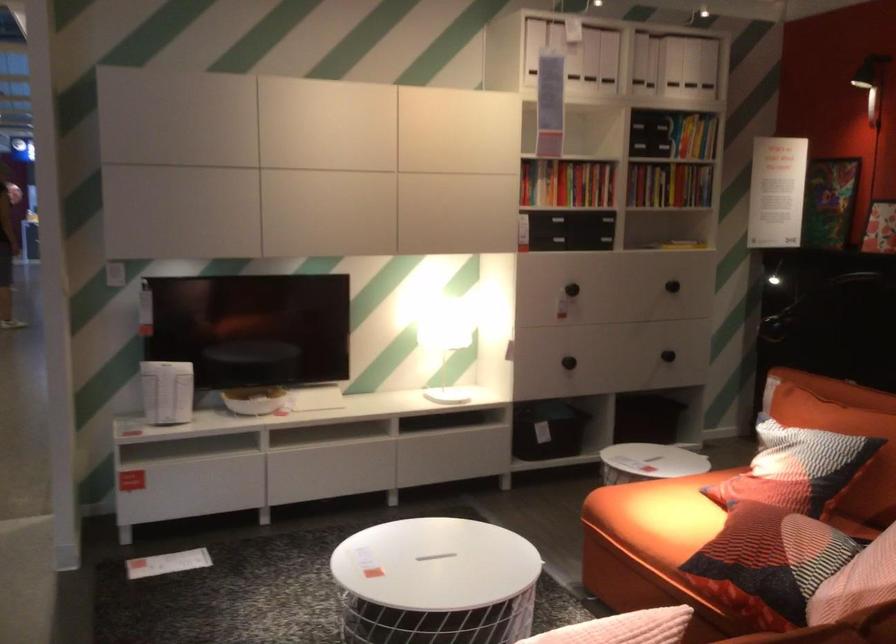
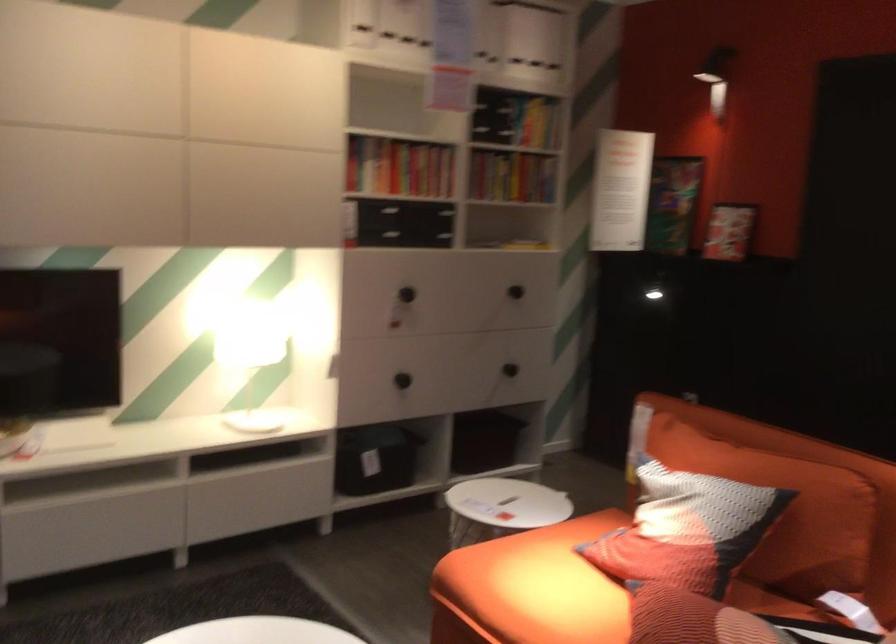
Question: What movement of the cameraman would produce the second image?

Choices:
 (A) Left
 (B) Right
 (C) Forward
 (D) Backward

Answer: (C)